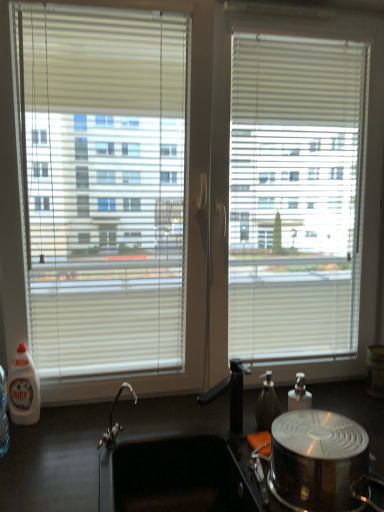
The width and height of the screenshot is (384, 512). In order to click on free space in front of white plastic bottle at left, placed as the first bottle when sorted from left to right in this screenshot , I will do click(x=29, y=443).